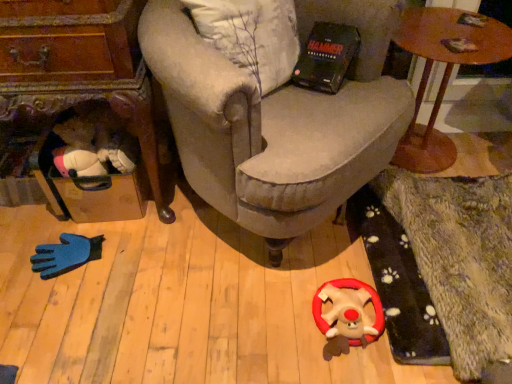
You are a GUI agent. You are given a task and a screenshot of the screen. Output one action in this format:
    pyautogui.click(x=<x>, y=<y>)
    Task: Click on the free space to the back side of fluffy plush toy at center
    
    Given the screenshot: What is the action you would take?
    pyautogui.click(x=327, y=272)